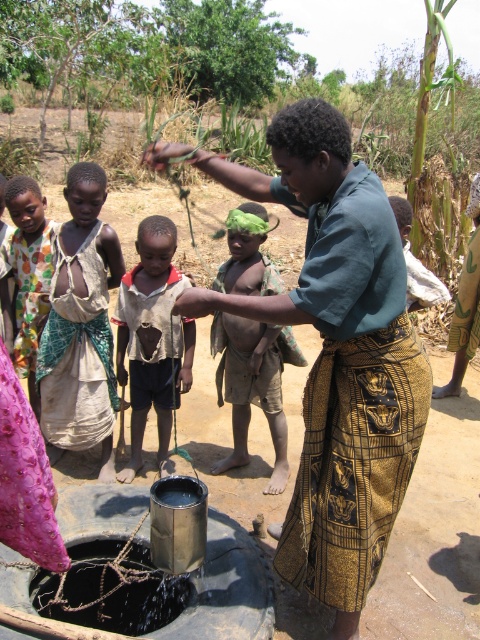
Question: Can you confirm if light brown fabric dress at center is wider than ripped fabric shirt at center?

Choices:
 (A) yes
 (B) no

Answer: (A)

Question: Which of the following is the closest to the observer?

Choices:
 (A) (73, 225)
 (B) (273, 378)
 (C) (140, 392)

Answer: (A)

Question: Does green fabric skirt at center lie behind brown textured shorts at center?

Choices:
 (A) no
 (B) yes

Answer: (A)

Question: Among these objects, which one is nearest to the camera?

Choices:
 (A) green fabric skirt at center
 (B) ripped fabric shirt at center
 (C) light brown fabric dress at center
 (D) brown textured shorts at center

Answer: (A)

Question: Where is green fabric skirt at center located in relation to brown textured shorts at center in the image?

Choices:
 (A) below
 (B) above

Answer: (A)

Question: Which point is farther to the camera?

Choices:
 (A) 284,452
 (B) 36,264
 (C) 188,326

Answer: (A)